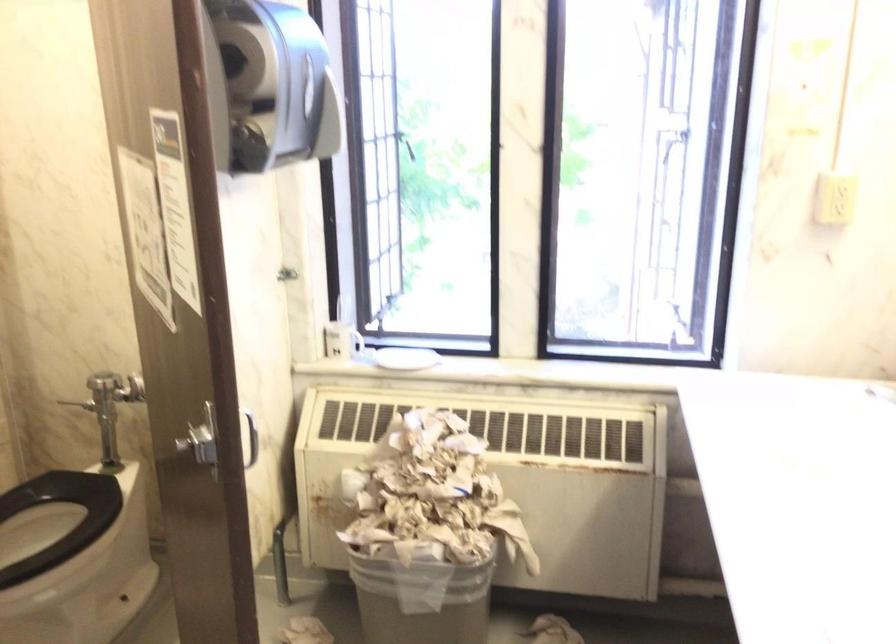
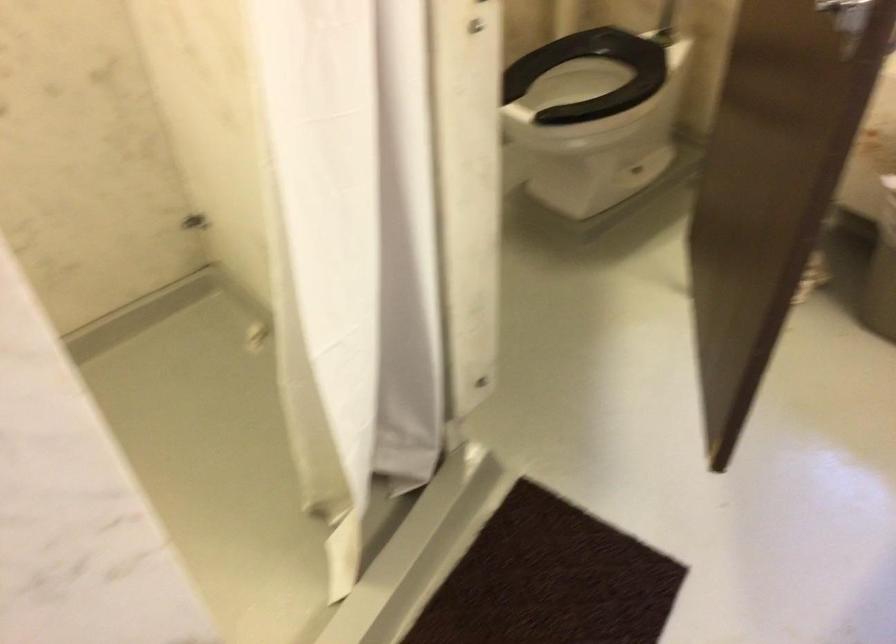
The first image is from the beginning of the video and the second image is from the end. How did the camera likely rotate when shooting the video?

The camera's rotation is toward left-down.